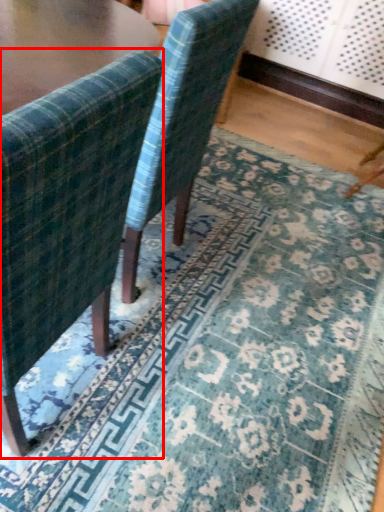
Question: From the image's perspective, where is chair (annotated by the red box) located in relation to chair in the image?

Choices:
 (A) above
 (B) below

Answer: (B)